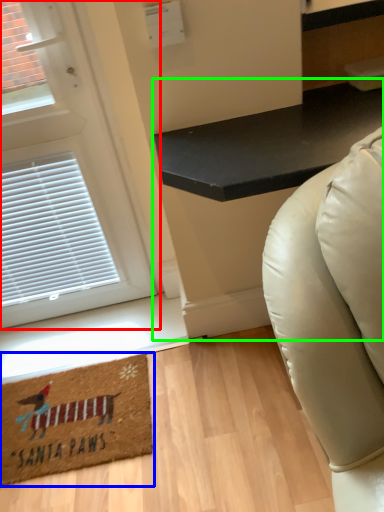
Question: Considering the real-world distances, which object is closest to door (highlighted by a red box)? mat (highlighted by a blue box) or table (highlighted by a green box).

Choices:
 (A) mat
 (B) table

Answer: (A)